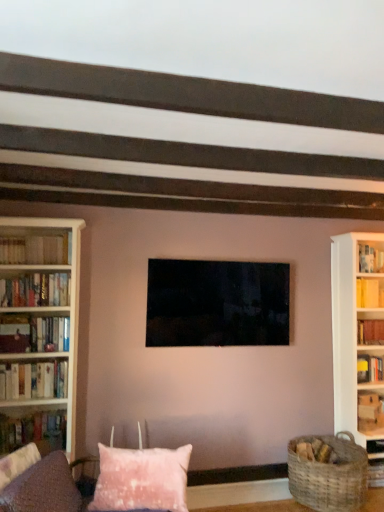
I want to click on vacant point above hardcover book at left, which ranks as the fifth book in left-to-right order (from a real-world perspective), so click(x=51, y=315).